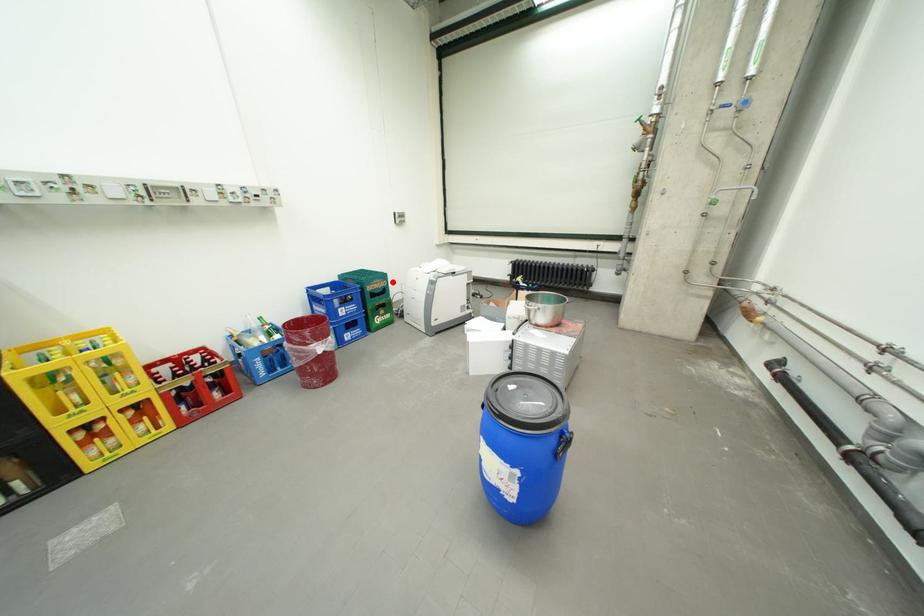
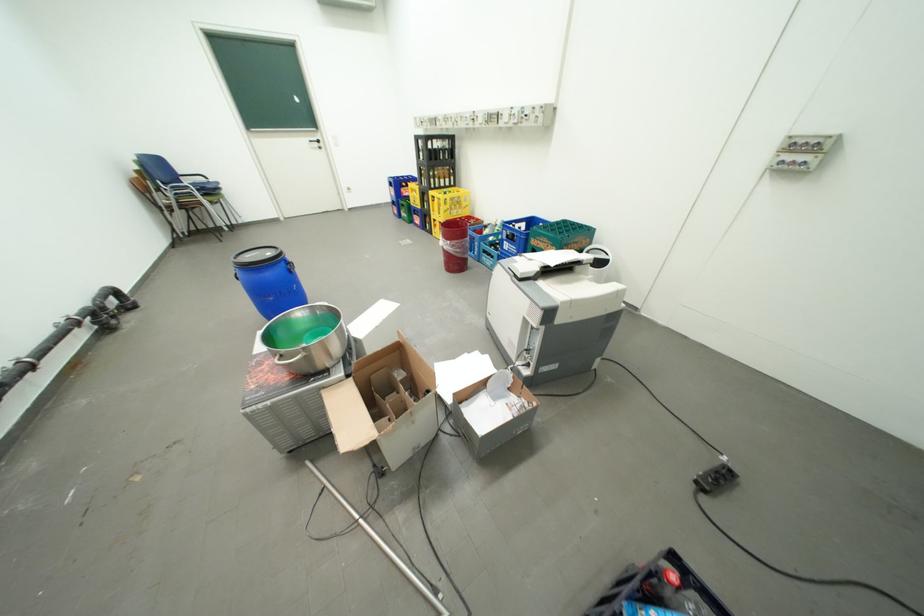
Find the pixel in the second image that matches the highlighted location in the first image.

(562, 246)